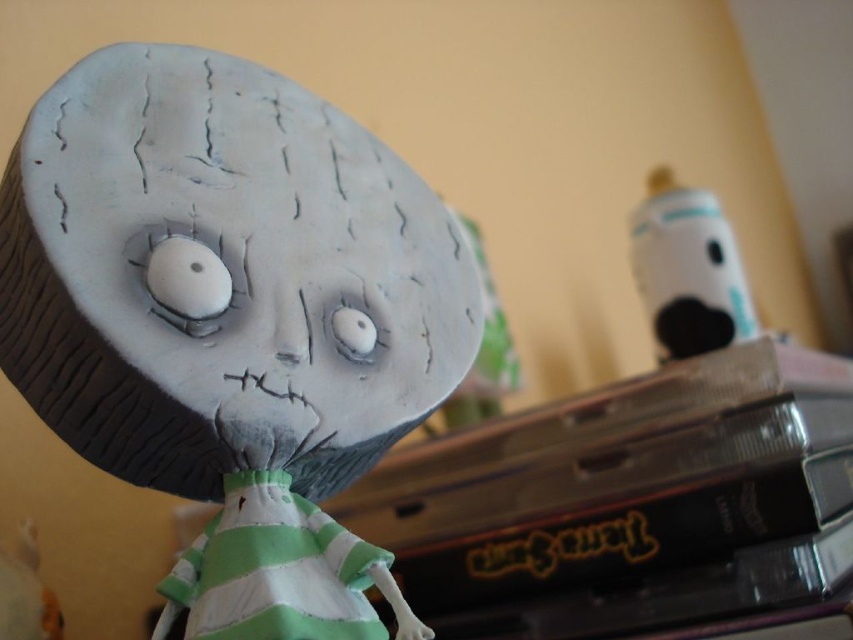
You are an observer looking at the handmade figurine scene. You see the matte clay doll at center and the white matte baby bottle at upper right. Which object is located higher in the image?

The white matte baby bottle at upper right is higher in the image since it is positioned above the matte clay doll at center.

You are an art curator examining a handmade clay figurine of Jack Skellington from The Nightmare Before Christmas. The figurine has a pale, cracked face with large white eyes and is wearing a green and white striped dress. You notice a specific point at coordinates point (223, 276). Can you describe the location of this point relative to the figurine?

The point (223, 276) corresponds to the location of the matte clay doll at center, which is the main subject of the image.

You are a delivery robot that needs to place a white matte baby bottle at upper right on a shelf that is 25 inches away from the current position. The shelf is directly in front of the matte clay doll at center. Can you place the bottle on the shelf without moving the doll?

The matte clay doll at center is 27.44 inches away from the white matte baby bottle at upper right. Since the shelf is 25 inches away from the current position and the doll is in front of it, the distance between the doll and the shelf is 2.44 inches. This means the robot cannot place the bottle on the shelf without moving the doll, as there isn